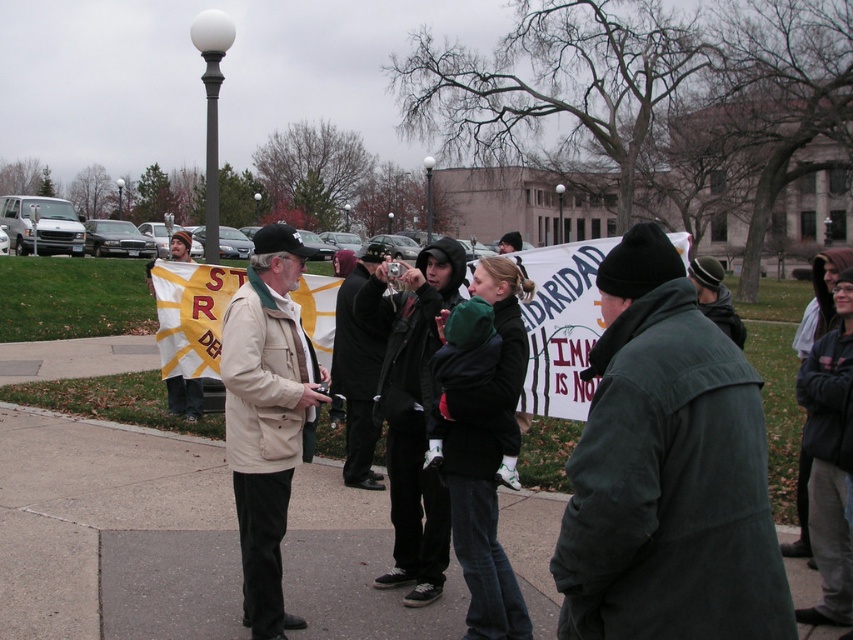
Question: Which point is farther from the camera taking this photo?

Choices:
 (A) 177,392
 (B) 720,285

Answer: (A)

Question: Does dark green jacket at center appear on the left side of beige fabric jacket at center?

Choices:
 (A) yes
 (B) no

Answer: (B)

Question: Is beige fabric jacket at center smaller than dark green knit cap at center?

Choices:
 (A) yes
 (B) no

Answer: (A)

Question: Which point appears farthest from the camera in this image?

Choices:
 (A) (268, 337)
 (B) (701, 515)
 (C) (722, 288)
 (D) (357, 336)

Answer: (D)

Question: Which of the following is the closest to the observer?

Choices:
 (A) (706, 301)
 (B) (283, 285)

Answer: (B)

Question: Does beige fabric jacket at center have a greater width compared to dark gray coat at center?

Choices:
 (A) no
 (B) yes

Answer: (B)